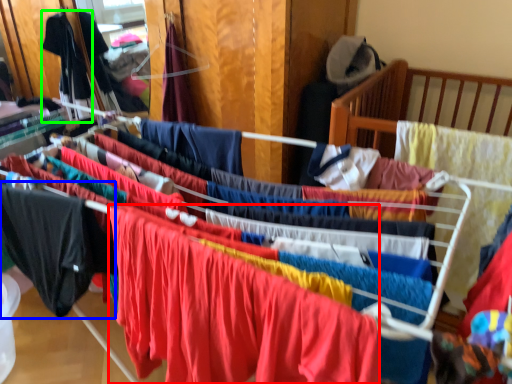
Question: Estimate the real-world distances between objects in this image. Which object is farther from clothing (highlighted by a red box), clothing (highlighted by a blue box) or clothing (highlighted by a green box)?

Choices:
 (A) clothing
 (B) clothing

Answer: (B)